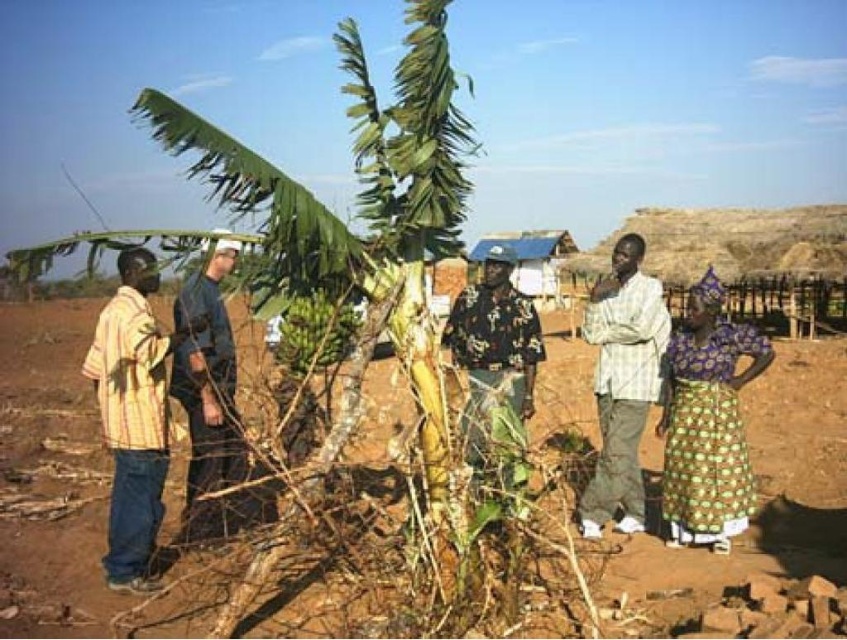
Is the position of brown soil at center more distant than that of dark blue uniform at center?

No, brown soil at center is in front of dark blue uniform at center.

The width and height of the screenshot is (847, 640). Identify the location of brown soil at center. (762, 492).

Is point (748, 420) less distant than point (187, 388)?

No, it is behind (187, 388).

You are a GUI agent. You are given a task and a screenshot of the screen. Output one action in this format:
    pyautogui.click(x=<x>, y=<y>)
    Task: Click on the brown soil at center
    
    Given the screenshot: What is the action you would take?
    pyautogui.click(x=762, y=492)

Which is in front, point (154, 269) or point (598, 356)?

Point (154, 269)

Does yellow striped shirt at left have a greater width compared to white checkered shirt at center?

Indeed, yellow striped shirt at left has a greater width compared to white checkered shirt at center.

Locate an element on the screen. yellow striped shirt at left is located at coordinates (131, 417).

You are a GUI agent. You are given a task and a screenshot of the screen. Output one action in this format:
    pyautogui.click(x=<x>, y=<y>)
    Task: Click on the brown soil at center
    
    Given the screenshot: What is the action you would take?
    pyautogui.click(x=762, y=492)

Does point (739, 560) come in front of point (684, 390)?

Yes, point (739, 560) is in front of point (684, 390).

What are the coordinates of `brown soil at center` in the screenshot? It's located at (762, 492).